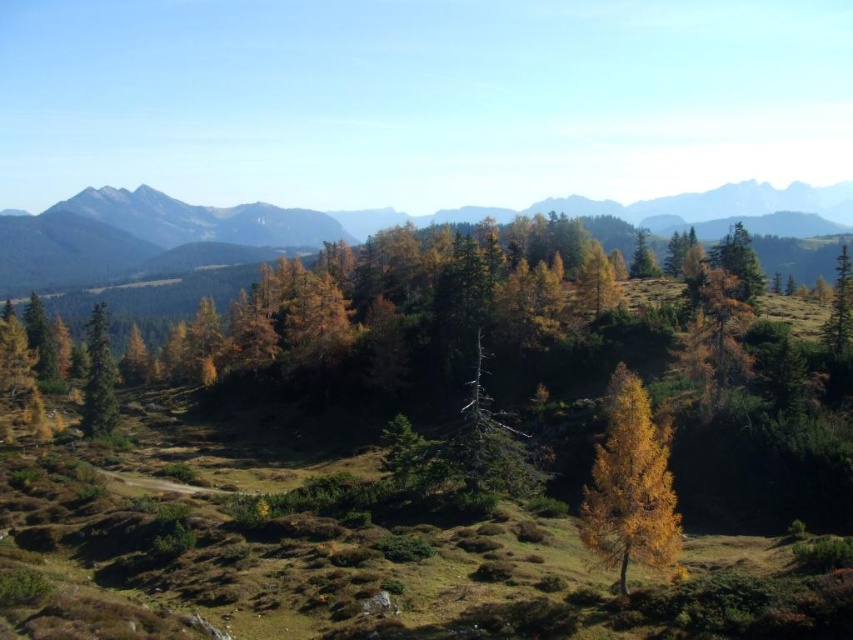
Does green textured mountain range at center appear under green matte tree at upper right?

No, green textured mountain range at center is not below green matte tree at upper right.

Between green textured mountain range at center and green matte tree at upper right, which one has more height?

green textured mountain range at center is taller.

Which is behind, point (750, 209) or point (846, 244)?

Positioned behind is point (750, 209).

The width and height of the screenshot is (853, 640). What are the coordinates of `green textured mountain range at center` in the screenshot? It's located at (339, 228).

Consider the image. Which of these two, yellow larch tree at center or green matte tree at left, stands taller?

green matte tree at left

Does yellow larch tree at center have a lesser height compared to green matte tree at left?

Correct, yellow larch tree at center is not as tall as green matte tree at left.

The image size is (853, 640). What are the coordinates of `yellow larch tree at center` in the screenshot? It's located at (630, 484).

Identify the location of yellow larch tree at center. (630, 484).

What do you see at coordinates (469, 445) in the screenshot? I see `golden foliage at center` at bounding box center [469, 445].

Can you confirm if golden foliage at center is shorter than green textured mountain range at center?

Yes, golden foliage at center is shorter than green textured mountain range at center.

The image size is (853, 640). I want to click on golden foliage at center, so point(469,445).